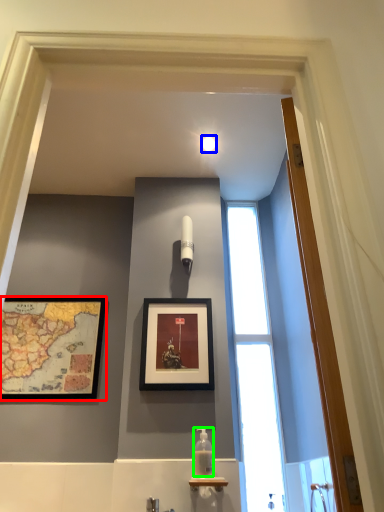
Question: Considering the real-world distances, which object is closest to picture frame (highlighted by a red box)? light fixture (highlighted by a blue box) or bottle (highlighted by a green box).

Choices:
 (A) light fixture
 (B) bottle

Answer: (B)